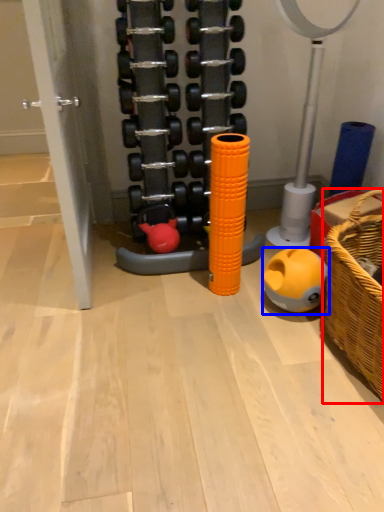
Question: Which object is closer to the camera taking this photo, basket (highlighted by a red box) or toy (highlighted by a blue box)?

Choices:
 (A) basket
 (B) toy

Answer: (A)